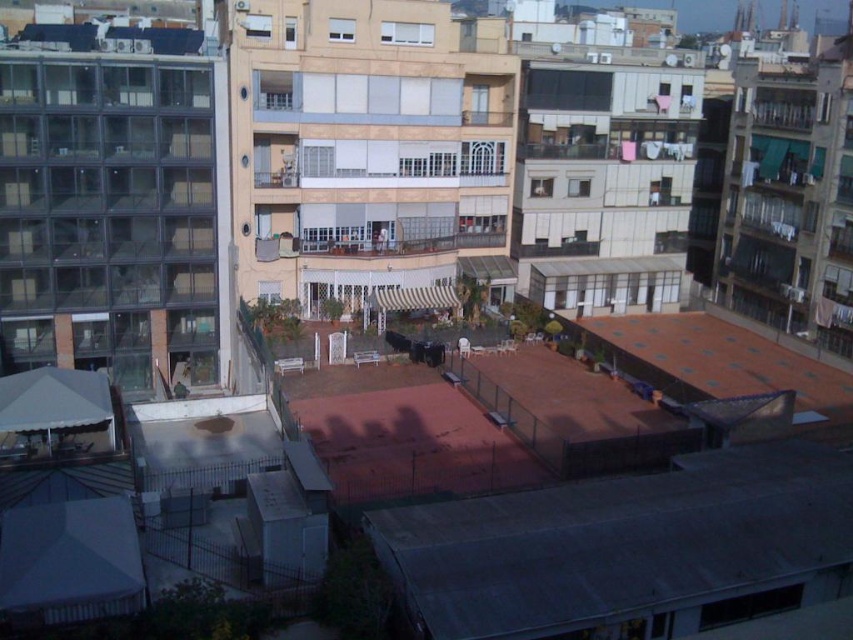
Between gray metal roof at lower center and brown tiled roof at lower right, which one has more height?

With more height is brown tiled roof at lower right.

Can you confirm if gray metal roof at lower center is positioned above brown tiled roof at lower right?

No.

Who is more forward, [409,545] or [698,336]?

Positioned in front is point [409,545].

The height and width of the screenshot is (640, 853). Identify the location of gray metal roof at lower center. (630, 548).